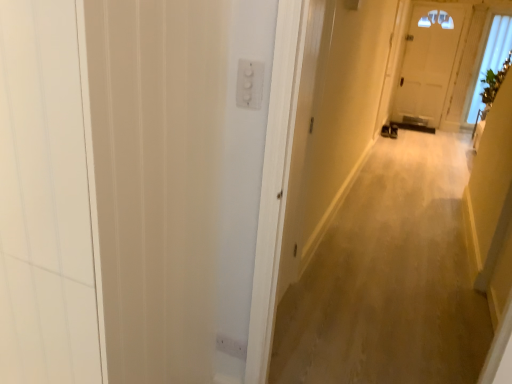
Question: Considering the relative positions of white plastic switch at upper center and transparent glass window at upper right in the image provided, is white plastic switch at upper center to the left of transparent glass window at upper right from the viewer's perspective?

Choices:
 (A) yes
 (B) no

Answer: (A)

Question: From a real-world perspective, is white plastic switch at upper center under transparent glass window at upper right?

Choices:
 (A) no
 (B) yes

Answer: (A)

Question: Is white plastic switch at upper center smaller than transparent glass window at upper right?

Choices:
 (A) no
 (B) yes

Answer: (B)

Question: Can you confirm if white plastic switch at upper center is bigger than transparent glass window at upper right?

Choices:
 (A) yes
 (B) no

Answer: (B)

Question: Is white plastic switch at upper center next to transparent glass window at upper right and touching it?

Choices:
 (A) yes
 (B) no

Answer: (B)

Question: Considering the positions of transparent glass window at upper right and white wood screen door at left in the image, is transparent glass window at upper right taller or shorter than white wood screen door at left?

Choices:
 (A) short
 (B) tall

Answer: (B)

Question: From a real-world perspective, relative to white wood screen door at left, is transparent glass window at upper right vertically above or below?

Choices:
 (A) below
 (B) above

Answer: (B)

Question: From the image's perspective, relative to white wood screen door at left, is transparent glass window at upper right above or below?

Choices:
 (A) above
 (B) below

Answer: (A)

Question: Is point (489, 51) closer or farther from the camera than point (180, 16)?

Choices:
 (A) farther
 (B) closer

Answer: (A)

Question: Is point (221, 243) positioned closer to the camera than point (249, 102)?

Choices:
 (A) closer
 (B) farther

Answer: (B)

Question: Looking at the image, does white wood screen door at left seem bigger or smaller compared to white plastic switch at upper center?

Choices:
 (A) big
 (B) small

Answer: (A)

Question: Is white wood screen door at left taller or shorter than white plastic switch at upper center?

Choices:
 (A) short
 (B) tall

Answer: (B)

Question: Is white wood screen door at left in front of or behind white plastic switch at upper center in the image?

Choices:
 (A) front
 (B) behind

Answer: (A)

Question: Choose the correct answer: Is beige carpet at center inside white plastic switch at upper center or outside it?

Choices:
 (A) inside
 (B) outside

Answer: (B)

Question: Based on their positions, is beige carpet at center located to the left or right of white plastic switch at upper center?

Choices:
 (A) right
 (B) left

Answer: (A)